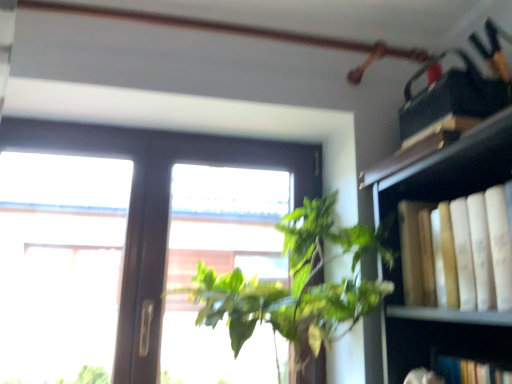
Question: Is yellow paper book at right inside the boundaries of green leafy plant at center, or outside?

Choices:
 (A) outside
 (B) inside

Answer: (A)

Question: Is point (506, 279) positioned closer to the camera than point (313, 339)?

Choices:
 (A) farther
 (B) closer

Answer: (B)

Question: Based on their relative distances, which object is nearer to the transparent glass window at center?

Choices:
 (A) green leafy plant at center
 (B) yellow paper book at right

Answer: (A)

Question: Estimate the real-world distances between objects in this image. Which object is farther from the yellow paper book at right?

Choices:
 (A) transparent glass window at center
 (B) green leafy plant at center

Answer: (A)